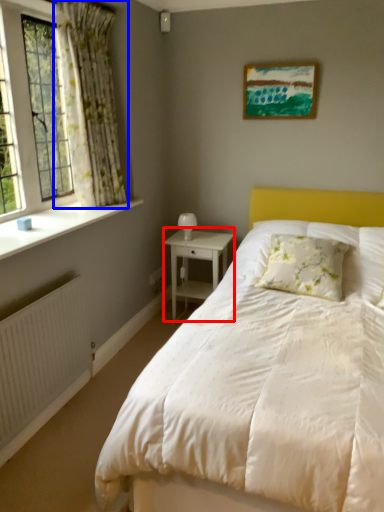
Question: Which point is further to the camera, nightstand (highlighted by a red box) or curtain (highlighted by a blue box)?

Choices:
 (A) nightstand
 (B) curtain

Answer: (A)